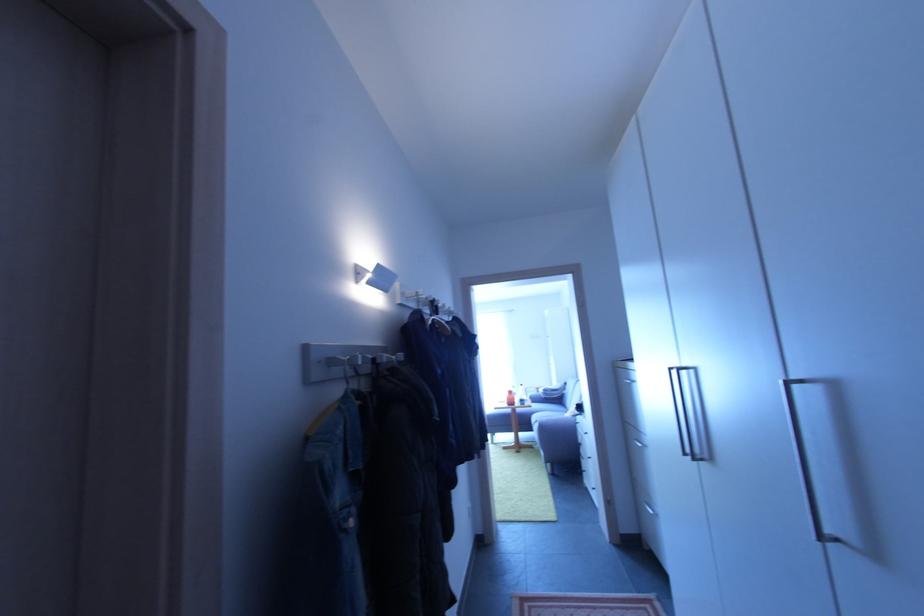
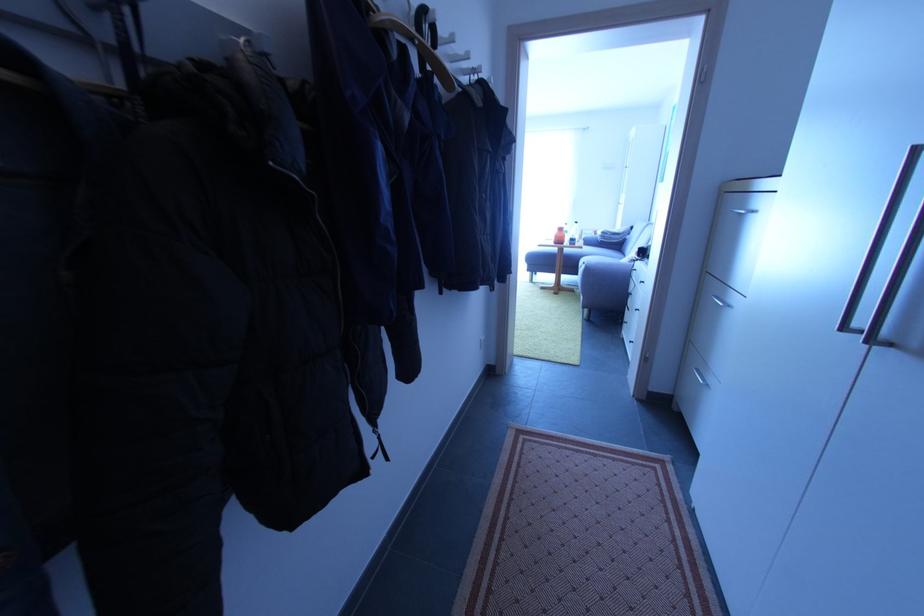
Where in the second image is the point corresponding to point (540, 426) from the first image?

(586, 268)